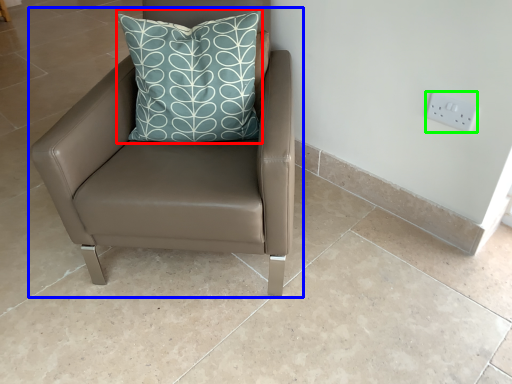
Question: Which object is the farthest from pillow (highlighted by a red box)? Choose among these: chair (highlighted by a blue box) or electric outlet (highlighted by a green box).

Choices:
 (A) chair
 (B) electric outlet

Answer: (B)